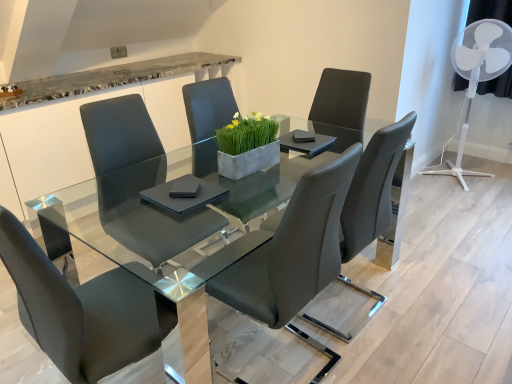
Question: Considering the positions of matte black chair at center, positioned as the second chair in left-to-right order, and white plastic fan at upper right in the image, is matte black chair at center, positioned as the second chair in left-to-right order, taller or shorter than white plastic fan at upper right?

Choices:
 (A) tall
 (B) short

Answer: (B)

Question: From a real-world perspective, relative to white plastic fan at upper right, is matte black chair at center, positioned as the second chair in left-to-right order, vertically above or below?

Choices:
 (A) above
 (B) below

Answer: (A)

Question: Considering the real-world distances, which object is closest to the white plastic fan at upper right?

Choices:
 (A) matte black chair at center, which is the 3th chair from right to left
 (B) transparent glass table at center
 (C) matte black chair at center, the 1th chair when ordered from right to left
 (D) matte black chair at center, the first chair viewed from the left
 (E) matte black chair at center, which is the 3th chair in left-to-right order

Answer: (C)

Question: Which object is positioned farthest from the matte black chair at center, the 2th chair when ordered from right to left?

Choices:
 (A) white plastic fan at upper right
 (B) transparent glass table at center
 (C) matte black chair at center, which is the 3th chair from right to left
 (D) matte black chair at center, the fourth chair viewed from the left
 (E) matte black chair at center, the 4th chair from the right

Answer: (A)